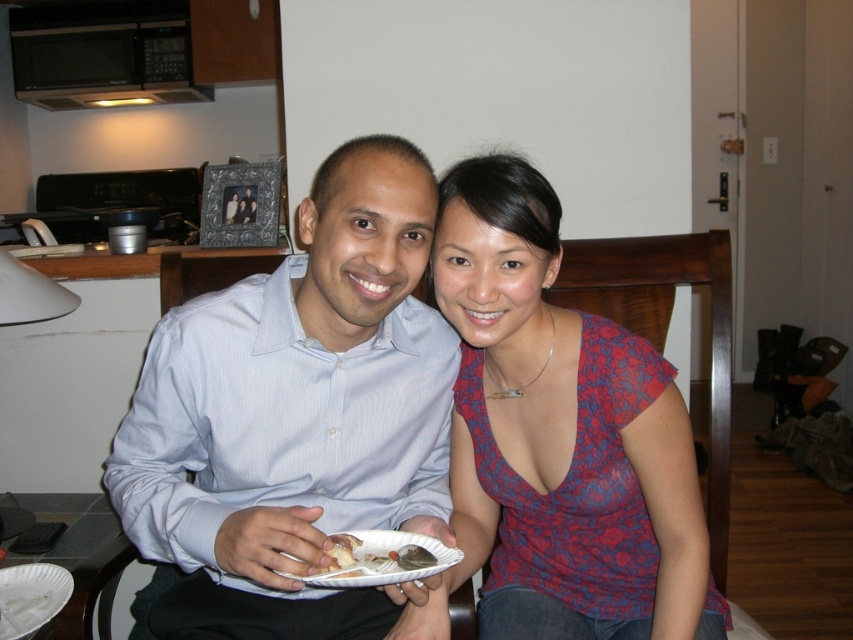
Is white paper plate at lower left positioned before white matte bread at center?

No, white paper plate at lower left is behind white matte bread at center.

Is point (33, 627) positioned after point (352, 541)?

Yes, it is behind point (352, 541).

The image size is (853, 640). In order to click on white paper plate at lower left in this screenshot , I will do `click(30, 596)`.

Find the location of a particular element. This screenshot has width=853, height=640. white paper plate at center is located at coordinates (383, 560).

Does white paper plate at center lie in front of white paper plate at lower left?

Yes, white paper plate at center is closer to the viewer.

Locate an element on the screen. white paper plate at center is located at coordinates (383, 560).

Between point (505, 220) and point (35, 80), which one is positioned behind?

Positioned behind is point (35, 80).

Which is in front, point (573, 404) or point (164, 86)?

Positioned in front is point (573, 404).

What are the coordinates of `floral fabric blouse at center` in the screenshot? It's located at (560, 435).